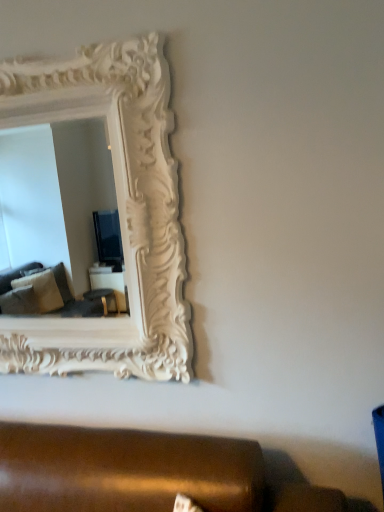
Question: Considering the positions of brown leather studio couch at lower center and white carved wood picture frame at upper left in the image, is brown leather studio couch at lower center taller or shorter than white carved wood picture frame at upper left?

Choices:
 (A) tall
 (B) short

Answer: (B)

Question: Relative to white carved wood picture frame at upper left, is brown leather studio couch at lower center in front or behind?

Choices:
 (A) front
 (B) behind

Answer: (A)

Question: Is brown leather studio couch at lower center spatially inside white carved wood picture frame at upper left, or outside of it?

Choices:
 (A) inside
 (B) outside

Answer: (B)

Question: Is white carved wood picture frame at upper left bigger or smaller than brown leather studio couch at lower center?

Choices:
 (A) big
 (B) small

Answer: (A)

Question: Is white carved wood picture frame at upper left inside the boundaries of brown leather studio couch at lower center, or outside?

Choices:
 (A) inside
 (B) outside

Answer: (B)

Question: From a real-world perspective, is white carved wood picture frame at upper left positioned above or below brown leather studio couch at lower center?

Choices:
 (A) below
 (B) above

Answer: (B)

Question: Would you say white carved wood picture frame at upper left is to the left or to the right of brown leather studio couch at lower center in the picture?

Choices:
 (A) right
 (B) left

Answer: (B)